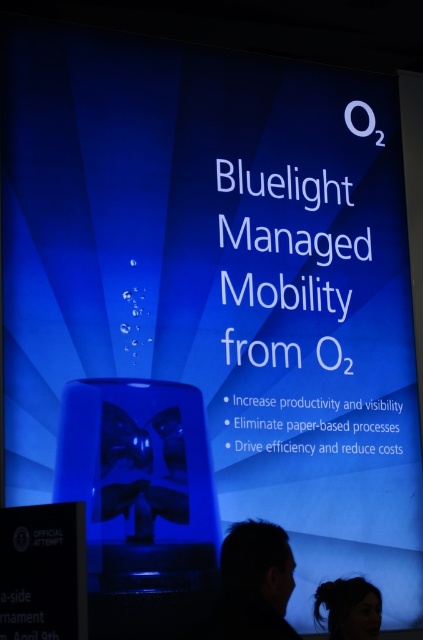
Is point (250, 528) positioned in front of point (359, 609)?

No, (250, 528) is behind (359, 609).

Does black matte hair at lower left appear under dark brown hair at lower center?

No, black matte hair at lower left is not below dark brown hair at lower center.

You are a GUI agent. You are given a task and a screenshot of the screen. Output one action in this format:
    pyautogui.click(x=<x>, y=<y>)
    Task: Click on the black matte hair at lower left
    
    Given the screenshot: What is the action you would take?
    pyautogui.click(x=253, y=584)